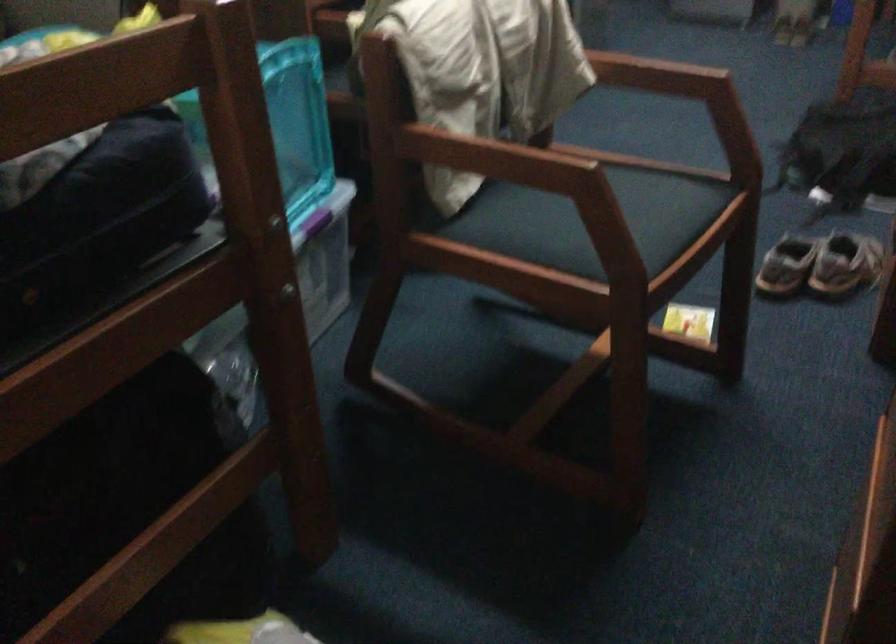
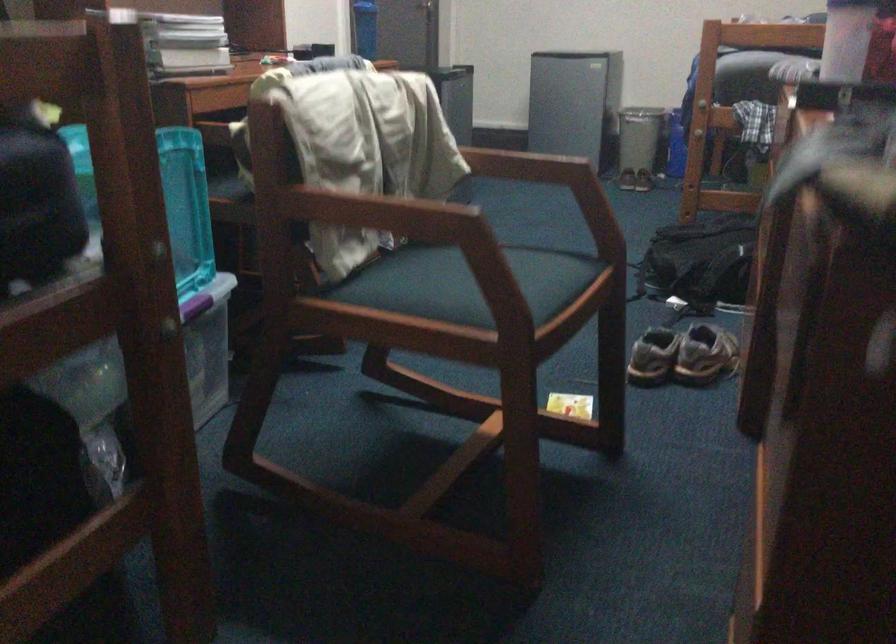
Where in the second image is the point corresponding to point (677, 118) from the first image?

(543, 242)